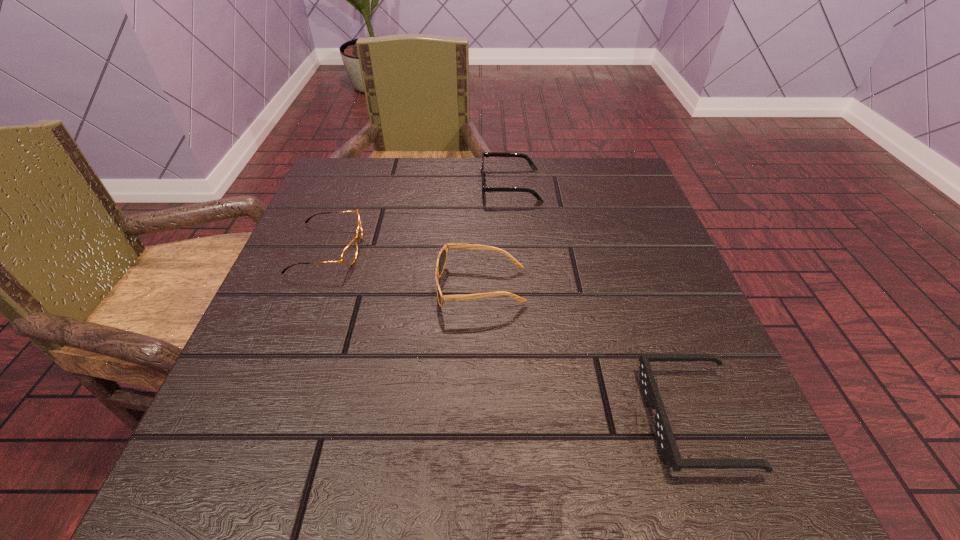
Image resolution: width=960 pixels, height=540 pixels. What are the coordinates of `free space located 0.140m on the front-facing side of the second nearest sunglasses` in the screenshot? It's located at (359, 287).

Locate an element on the screen. The image size is (960, 540). vacant region located on the front-facing side of the spectacles is located at coordinates tap(529, 249).

Find the location of a particular element. This screenshot has height=540, width=960. blank space located 0.060m on the front-facing side of the shortest sunglasses is located at coordinates (606, 419).

Where is `vacant space located 0.280m on the front-facing side of the shortest sunglasses`? This screenshot has width=960, height=540. vacant space located 0.280m on the front-facing side of the shortest sunglasses is located at coordinates (446, 419).

The height and width of the screenshot is (540, 960). I want to click on free space located 0.060m on the front-facing side of the shortest sunglasses, so click(x=606, y=419).

Locate an element on the screen. The height and width of the screenshot is (540, 960). object at the far edge is located at coordinates (484, 154).

Where is `object that is at the near edge`? The height and width of the screenshot is (540, 960). object that is at the near edge is located at coordinates (665, 439).

Find the location of a particular element. This screenshot has width=960, height=540. object situated at the left edge is located at coordinates 349,254.

The image size is (960, 540). What are the coordinates of `object that is at the right edge` in the screenshot? It's located at (665, 439).

Find the location of a particular element. This screenshot has width=960, height=540. object that is positioned at the near right corner is located at coordinates (665, 439).